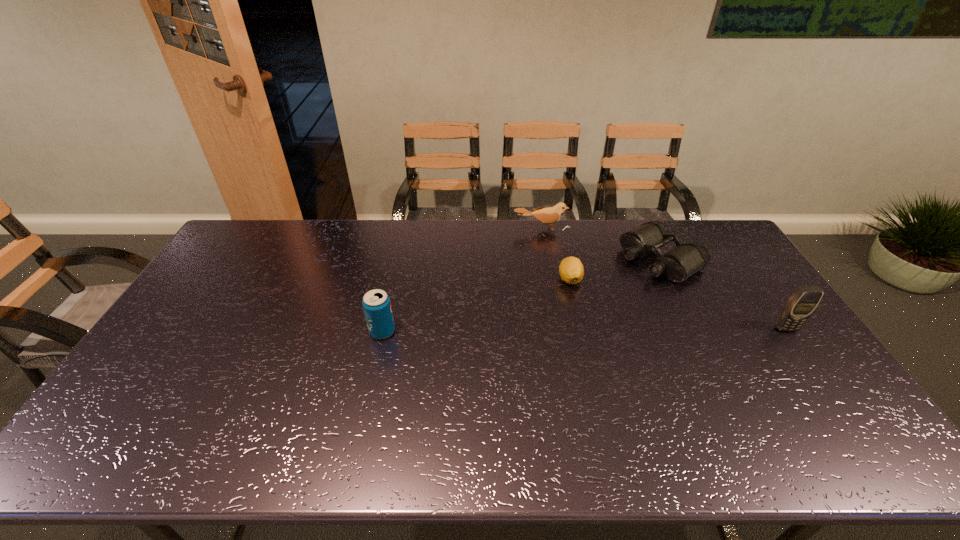
What are the coordinates of `object that is the second nearest to the rightmost object` in the screenshot? It's located at (571, 270).

At what (x,y) coordinates should I click in order to perform the action: click on free point that satisfies the following two spatial constraints: 1. on the front side of the farthest object; 2. on the right side of the second shortest object. Please return your answer as a coordinate pair (x, y). The image size is (960, 540). Looking at the image, I should click on (547, 259).

This screenshot has width=960, height=540. In order to click on free location that satisfies the following two spatial constraints: 1. on the front side of the second object from right to left; 2. on the left side of the third shortest object in this screenshot , I will do `click(547, 259)`.